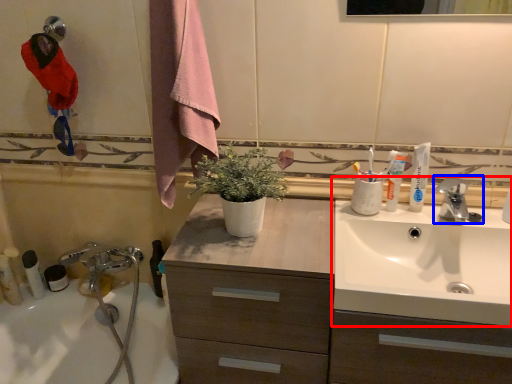
Question: Which of the following is the closest to the observer, sink (highlighted by a red box) or tap (highlighted by a blue box)?

Choices:
 (A) sink
 (B) tap

Answer: (A)